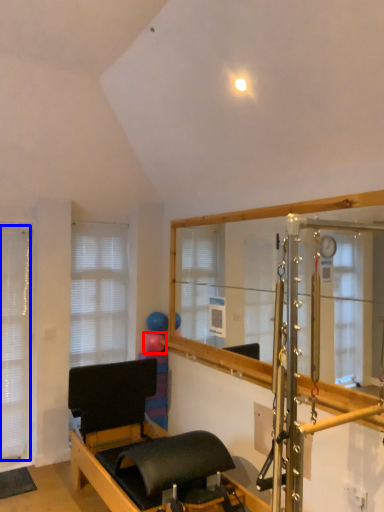
Question: Which of the following is the farthest to the observer, balloon (highlighted by a red box) or blind (highlighted by a blue box)?

Choices:
 (A) balloon
 (B) blind

Answer: (A)